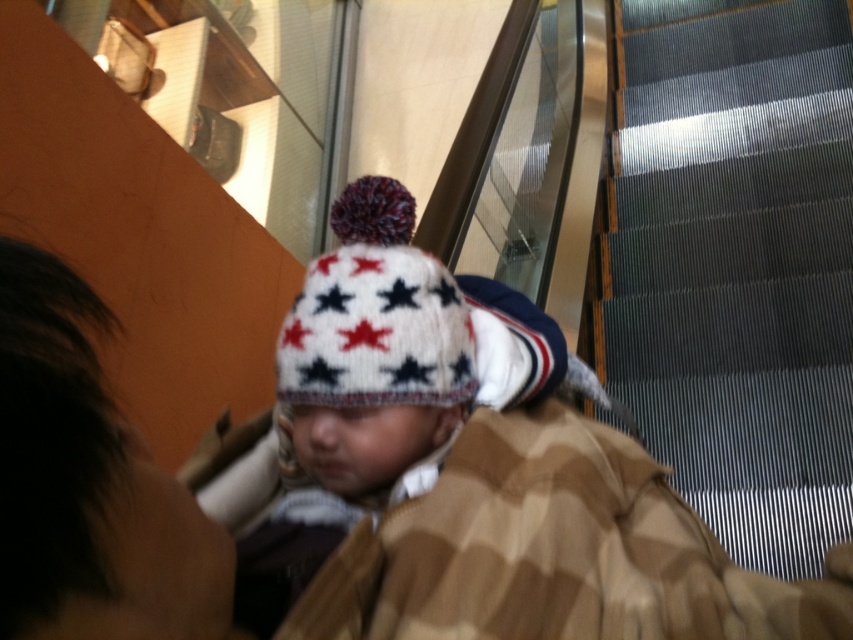
Can you confirm if metallic gray stairs at right is smaller than white knitted hat at center?

No, metallic gray stairs at right is not smaller than white knitted hat at center.

Is metallic gray stairs at right to the right of white knitted hat at center from the viewer's perspective?

Correct, you'll find metallic gray stairs at right to the right of white knitted hat at center.

What are the coordinates of `metallic gray stairs at right` in the screenshot? It's located at (734, 262).